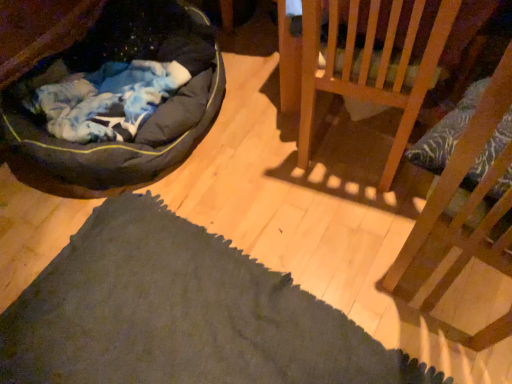
What are the coordinates of `free point below wooden chair at right, acting as the 1th furniture starting from the front (from a real-world perspective)` in the screenshot? It's located at (460, 286).